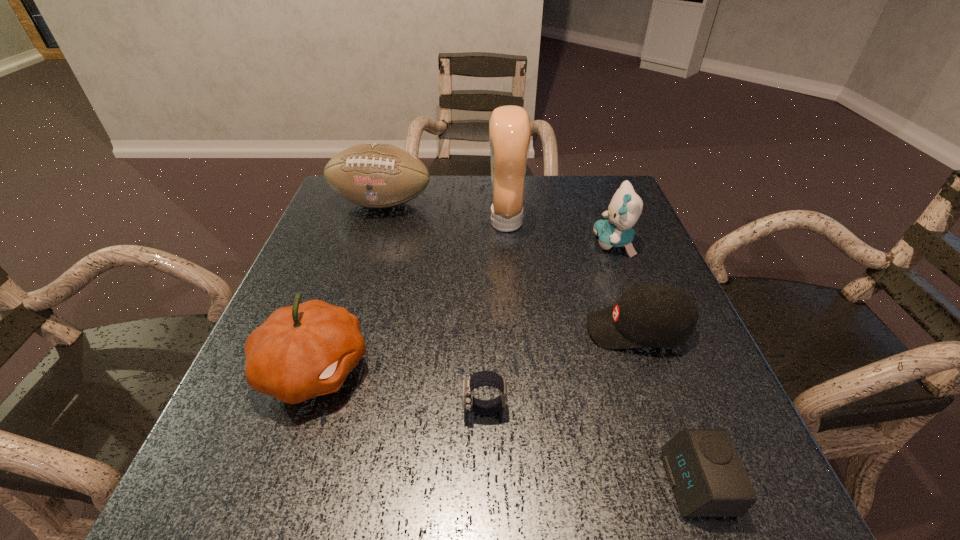
The width and height of the screenshot is (960, 540). Identify the location of vacant space situated 0.250m on the face of the watch. (313, 409).

Locate an element on the screen. The height and width of the screenshot is (540, 960). free region located on the face of the watch is located at coordinates click(x=343, y=409).

Where is `vacant region located 0.090m on the front-facing side of the shortest object`? vacant region located 0.090m on the front-facing side of the shortest object is located at coordinates (608, 483).

Identify the location of free space located 0.190m on the front-facing side of the shortest object. (539, 483).

I want to click on vacant space located on the front-facing side of the shortest object, so click(587, 483).

Locate an element on the screen. The width and height of the screenshot is (960, 540). condiment that is positioned at the far edge is located at coordinates (509, 126).

Locate an element on the screen. This screenshot has height=540, width=960. football (American) that is at the far edge is located at coordinates (375, 175).

The width and height of the screenshot is (960, 540). I want to click on object that is at the near edge, so click(x=708, y=479).

Where is `football (American) located in the left edge section of the desktop`? football (American) located in the left edge section of the desktop is located at coordinates (375, 175).

Image resolution: width=960 pixels, height=540 pixels. What are the coordinates of `pumpkin at the left edge` in the screenshot? It's located at (306, 350).